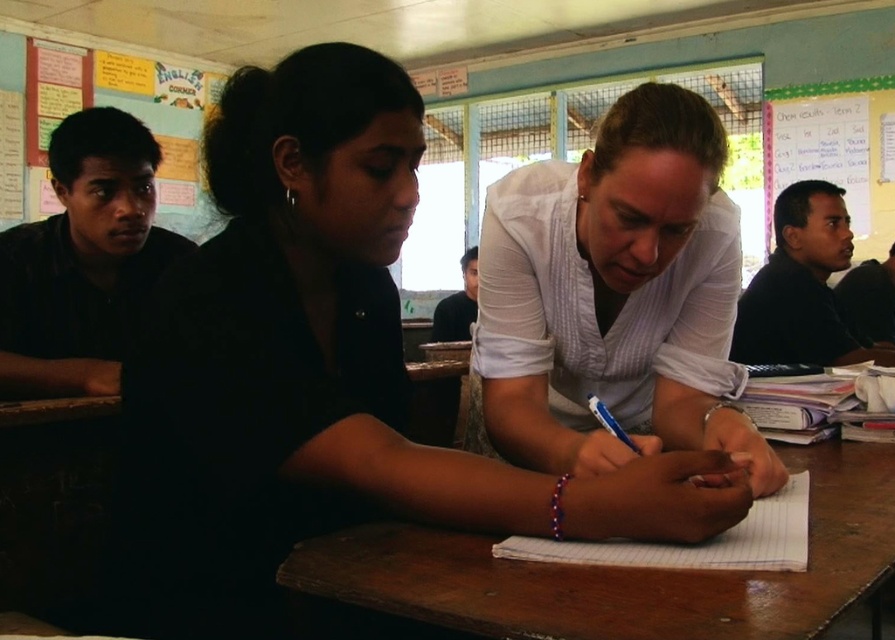
Does wooden table at center come in front of multicolored paper notices at upper left?

That is True.

Is wooden table at center thinner than multicolored paper notices at upper left?

No, wooden table at center is not thinner than multicolored paper notices at upper left.

Identify the location of wooden table at center. (623, 572).

What are the coordinates of `wooden table at center` in the screenshot? It's located at (623, 572).

Which of these two, wooden table at center or white paper at center, stands taller?

wooden table at center

Does wooden table at center appear over white paper at center?

No.

Image resolution: width=895 pixels, height=640 pixels. What are the coordinates of `wooden table at center` in the screenshot? It's located at tap(623, 572).

Between white matte shirt at center and multicolored paper notices at upper left, which one is positioned lower?

Positioned lower is white matte shirt at center.

Who is positioned more to the right, white matte shirt at center or multicolored paper notices at upper left?

white matte shirt at center

Where is `white matte shirt at center`? Image resolution: width=895 pixels, height=640 pixels. white matte shirt at center is located at coordinates (320, 371).